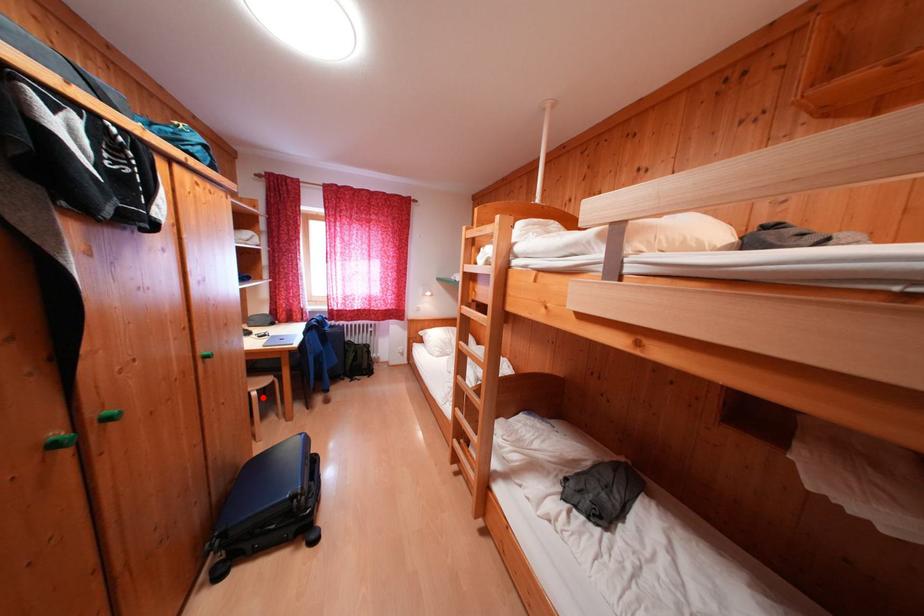
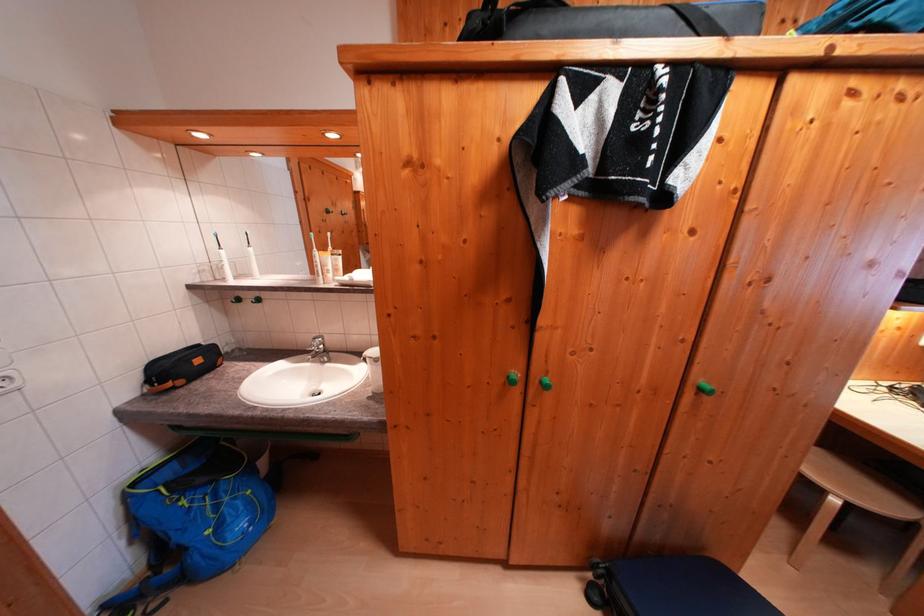
Question: I am providing you with two images of the same scene from different viewpoints. In image1, a red point is highlighted. Considering the same 3D point in image2, which of the following is correct?

Choices:
 (A) It is closer
 (B) It is farther

Answer: (A)